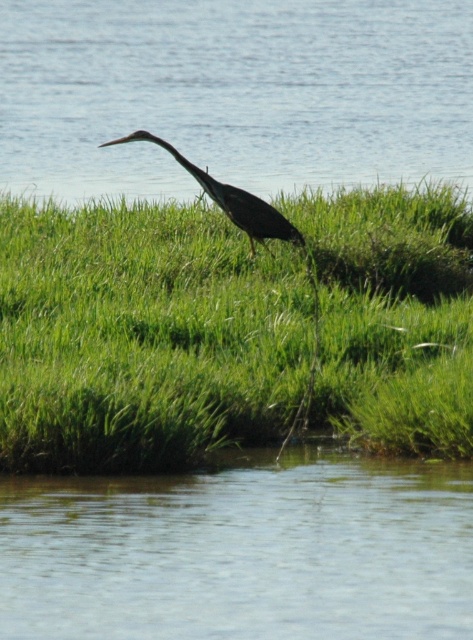
Who is positioned more to the left, clear blue water at center or dark gray matte bird at center?

Positioned to the left is clear blue water at center.

Which is more to the right, clear blue water at center or dark gray matte bird at center?

From the viewer's perspective, dark gray matte bird at center appears more on the right side.

Identify the location of clear blue water at center. (233, 93).

Can you confirm if green grassy at center is positioned to the right of dark gray matte bird at center?

Indeed, green grassy at center is positioned on the right side of dark gray matte bird at center.

Where is `green grassy at center`? The width and height of the screenshot is (473, 640). green grassy at center is located at coordinates (142, 337).

Is point (262, 317) positioned in front of point (266, 208)?

Yes, it is.

Find the location of `green grassy at center`. green grassy at center is located at coordinates (142, 337).

Is green grassy at center shorter than clear blue water at center?

Correct, green grassy at center is not as tall as clear blue water at center.

Is green grassy at center bigger than clear blue water at center?

No, green grassy at center is not bigger than clear blue water at center.

Is point (78, 228) less distant than point (251, 84)?

Yes, it is.

This screenshot has height=640, width=473. What are the coordinates of `green grassy at center` in the screenshot? It's located at (142, 337).